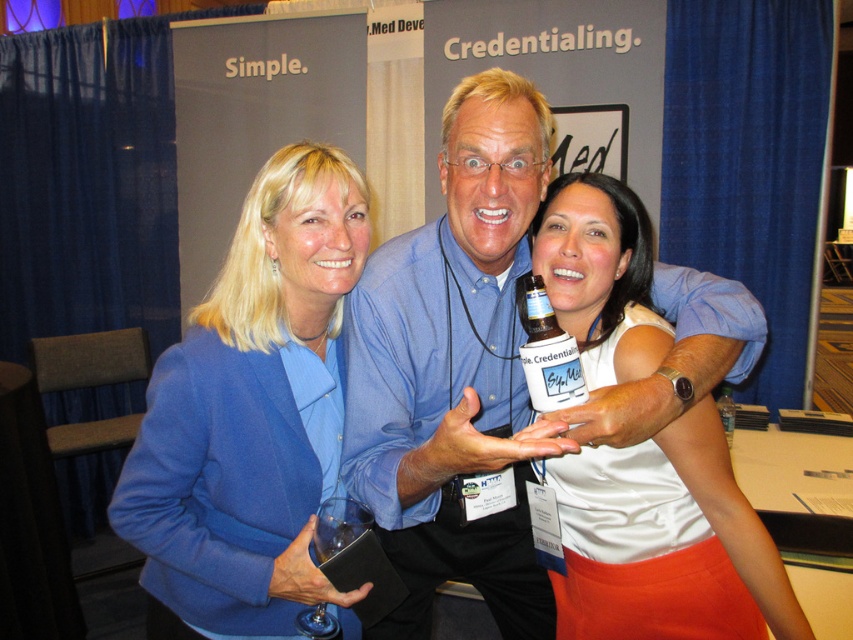
Can you confirm if blue shirt at center is taller than white matte tank top at center?

Yes, blue shirt at center is taller than white matte tank top at center.

At what (x,y) coordinates should I click in order to perform the action: click on blue shirt at center. Please return your answer as a coordinate pair (x, y). Looking at the image, I should click on (456, 369).

In the scene shown: Does blue shirt at center lie in front of clear plastic bottle at center?

Yes, blue shirt at center is in front of clear plastic bottle at center.

Can you confirm if blue shirt at center is shorter than clear plastic bottle at center?

In fact, blue shirt at center may be taller than clear plastic bottle at center.

Describe the element at coordinates (456, 369) in the screenshot. Image resolution: width=853 pixels, height=640 pixels. I see `blue shirt at center` at that location.

Identify the location of blue shirt at center. The height and width of the screenshot is (640, 853). (456, 369).

Who is positioned more to the left, blue fabric jacket at center or translucent plastic bottle at center?

blue fabric jacket at center is more to the left.

Who is lower down, blue fabric jacket at center or translucent plastic bottle at center?

Positioned lower is blue fabric jacket at center.

Which is behind, point (334, 232) or point (531, 308)?

The point (334, 232) is behind.

Locate an element on the screen. The image size is (853, 640). blue fabric jacket at center is located at coordinates (250, 413).